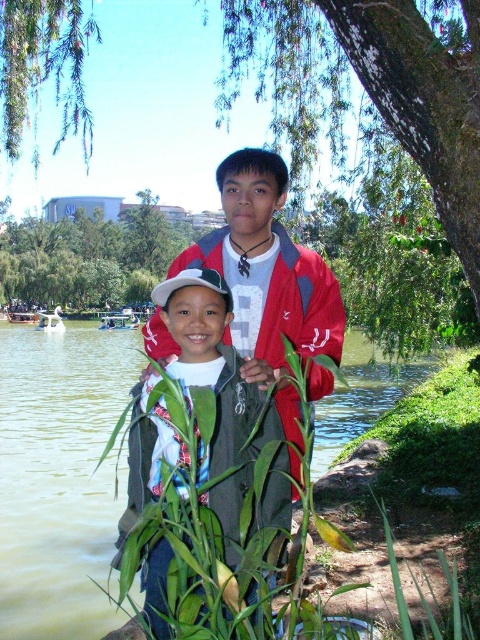
Question: Which point appears farthest from the camera in this image?

Choices:
 (A) (23, 58)
 (B) (87, 445)
 (C) (176, 481)

Answer: (B)

Question: Is green leafy plant at center smaller than green leafy tree at center?

Choices:
 (A) yes
 (B) no

Answer: (A)

Question: Is green leafy plant at center to the left of green leafy tree at center from the viewer's perspective?

Choices:
 (A) no
 (B) yes

Answer: (A)

Question: Does green leafy plant at center appear under green leafy tree at center?

Choices:
 (A) yes
 (B) no

Answer: (A)

Question: Which point appears farthest from the camera in this image?

Choices:
 (A) (156, 433)
 (B) (196, 230)

Answer: (B)

Question: Among these points, which one is nearest to the camera?

Choices:
 (A) pos(6,557)
 (B) pos(91,36)
 (C) pos(41,282)

Answer: (B)